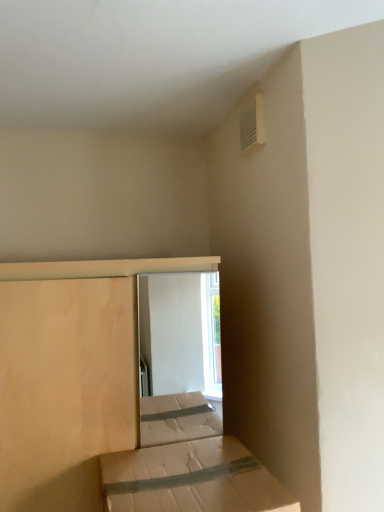
Question: Which direction should I rotate to face natural wood bed at center, marked as the 1th bed in a back-to-front arrangement, — up or down?

Choices:
 (A) down
 (B) up

Answer: (A)

Question: Is natural wood bed at center, positioned as the 2th bed in front-to-back order, turned away from white plastic vent at upper right?

Choices:
 (A) no
 (B) yes

Answer: (A)

Question: Is natural wood bed at center, marked as the 1th bed in a back-to-front arrangement, smaller than white plastic vent at upper right?

Choices:
 (A) yes
 (B) no

Answer: (B)

Question: Is the position of natural wood bed at center, positioned as the 2th bed in front-to-back order, more distant than that of white plastic vent at upper right?

Choices:
 (A) no
 (B) yes

Answer: (A)

Question: Is natural wood bed at center, marked as the 1th bed in a back-to-front arrangement, outside of white plastic vent at upper right?

Choices:
 (A) yes
 (B) no

Answer: (A)

Question: Considering the relative sizes of natural wood bed at center, marked as the 1th bed in a back-to-front arrangement, and white plastic vent at upper right in the image provided, is natural wood bed at center, marked as the 1th bed in a back-to-front arrangement, shorter than white plastic vent at upper right?

Choices:
 (A) no
 (B) yes

Answer: (A)

Question: Can you confirm if natural wood bed at center, marked as the 1th bed in a back-to-front arrangement, is wider than white plastic vent at upper right?

Choices:
 (A) yes
 (B) no

Answer: (A)

Question: Is brown cardboard box at lower center, marked as the 1th bed in a front-to-back arrangement, at the right side of natural wood bed at center, positioned as the 2th bed in front-to-back order?

Choices:
 (A) yes
 (B) no

Answer: (A)

Question: Considering the relative sizes of brown cardboard box at lower center, marked as the second bed in a back-to-front arrangement, and natural wood bed at center, marked as the 1th bed in a back-to-front arrangement, in the image provided, is brown cardboard box at lower center, marked as the second bed in a back-to-front arrangement, shorter than natural wood bed at center, marked as the 1th bed in a back-to-front arrangement,?

Choices:
 (A) yes
 (B) no

Answer: (A)

Question: Is brown cardboard box at lower center, marked as the 1th bed in a front-to-back arrangement, further to camera compared to natural wood bed at center, marked as the 1th bed in a back-to-front arrangement?

Choices:
 (A) yes
 (B) no

Answer: (B)

Question: Could you tell me if brown cardboard box at lower center, marked as the second bed in a back-to-front arrangement, is facing natural wood bed at center, marked as the 1th bed in a back-to-front arrangement?

Choices:
 (A) no
 (B) yes

Answer: (A)

Question: Can you confirm if brown cardboard box at lower center, marked as the second bed in a back-to-front arrangement, is smaller than natural wood bed at center, positioned as the 2th bed in front-to-back order?

Choices:
 (A) yes
 (B) no

Answer: (A)

Question: Does brown cardboard box at lower center, marked as the 1th bed in a front-to-back arrangement, have a larger size compared to natural wood bed at center, positioned as the 2th bed in front-to-back order?

Choices:
 (A) no
 (B) yes

Answer: (A)

Question: Can you confirm if white plastic vent at upper right is thinner than brown cardboard box at lower center, marked as the second bed in a back-to-front arrangement?

Choices:
 (A) no
 (B) yes

Answer: (B)